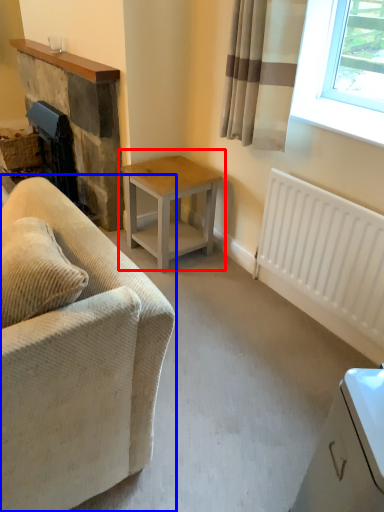
Question: Among these objects, which one is farthest to the camera, table (highlighted by a red box) or studio couch (highlighted by a blue box)?

Choices:
 (A) table
 (B) studio couch

Answer: (A)